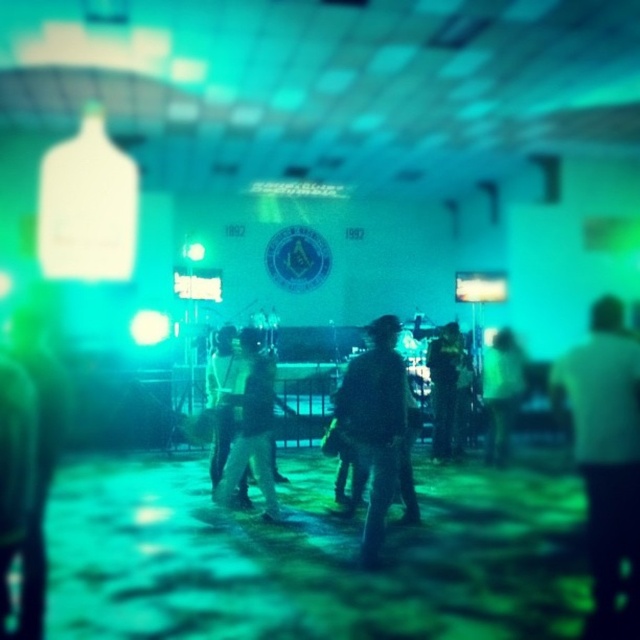
Does point (486, 458) come closer to viewer compared to point (445, 388)?

Yes, point (486, 458) is in front of point (445, 388).

At what (x,y) coordinates should I click in order to perform the action: click on green fabric jacket at center. Please return your answer as a coordinate pair (x, y). Image resolution: width=640 pixels, height=640 pixels. Looking at the image, I should click on (500, 392).

This screenshot has height=640, width=640. Find the location of `green fabric jacket at center`. green fabric jacket at center is located at coordinates (500, 392).

Between white matte shirt at right and matte black jacket at left, which one appears on the right side from the viewer's perspective?

white matte shirt at right is more to the right.

The height and width of the screenshot is (640, 640). Identify the location of white matte shirt at right. (605, 460).

Which is in front, point (636, 483) or point (33, 502)?

Point (33, 502) is in front.

The image size is (640, 640). What are the coordinates of `white matte shirt at right` in the screenshot? It's located at (605, 460).

Is point (372, 333) positioned in front of point (273, 378)?

Yes, it is.

Which is in front, point (358, 554) or point (244, 468)?

Point (358, 554)

Find the location of a particular element. The image size is (640, 640). dark denim jacket at center is located at coordinates (372, 424).